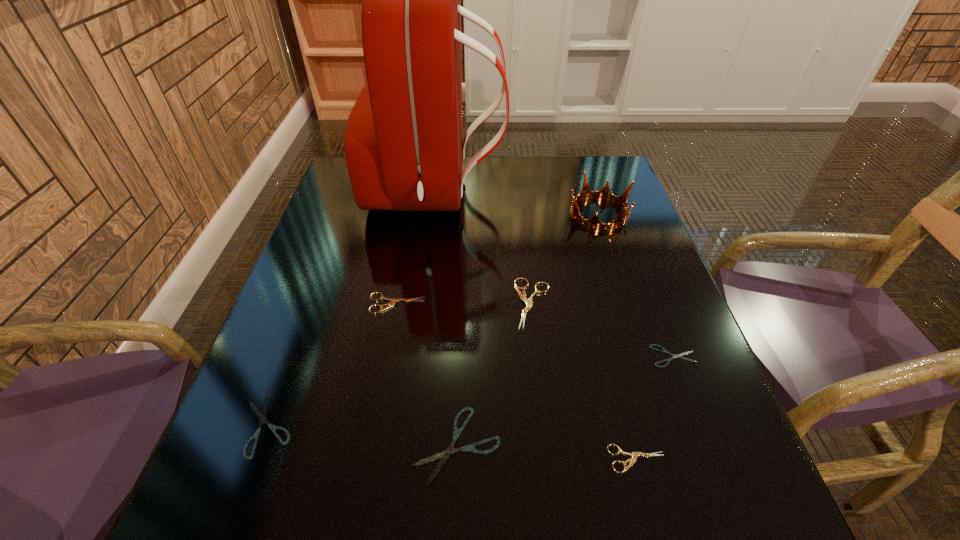
Identify which beige shears is located as the nearest to the leftmost object. Please provide its 2D coordinates. Your answer should be formatted as a tuple, i.e. [(x, y)], where the tuple contains the x and y coordinates of a point satisfying the conditions above.

[(394, 300)]

The image size is (960, 540). I want to click on the second closest black shears relative to the fourth nearest object, so click(x=262, y=416).

Point out which black shears is positioned as the nearest to the fifth object from left to right. Please provide its 2D coordinates. Your answer should be formatted as a tuple, i.e. [(x, y)], where the tuple contains the x and y coordinates of a point satisfying the conditions above.

[(444, 455)]

You are a GUI agent. You are given a task and a screenshot of the screen. Output one action in this format:
    pyautogui.click(x=<x>, y=<y>)
    Task: Click on the vacant space that satisfies the following two spatial constraints: 1. on the strap side of the seventh shortest object; 2. on the right side of the tallest object
    
    Given the screenshot: What is the action you would take?
    pyautogui.click(x=434, y=213)

Find the location of a particular element. The height and width of the screenshot is (540, 960). free region that satisfies the following two spatial constraints: 1. on the front side of the smallest beige shears; 2. on the right side of the leftmost shears is located at coordinates (255, 458).

Identify the location of vacant space that satisfies the following two spatial constraints: 1. on the strap side of the seventh shortest object; 2. on the left side of the tallest object. (434, 213).

You are a GUI agent. You are given a task and a screenshot of the screen. Output one action in this format:
    pyautogui.click(x=<x>, y=<y>)
    Task: Click on the free space in the image that satisfies the following two spatial constraints: 1. on the back side of the leftmost object; 2. on the left side of the fifth shortest object
    The width and height of the screenshot is (960, 540).
    Given the screenshot: What is the action you would take?
    pyautogui.click(x=312, y=303)

This screenshot has height=540, width=960. In order to click on vacant position in the image that satisfies the following two spatial constraints: 1. on the back side of the gold crown; 2. on the strap side of the backpack in this screenshot , I will do `click(592, 191)`.

Where is `vacant area that satisfies the following two spatial constraints: 1. on the strap side of the pink backpack; 2. on the front side of the fifth shortest shears`? vacant area that satisfies the following two spatial constraints: 1. on the strap side of the pink backpack; 2. on the front side of the fifth shortest shears is located at coordinates (422, 303).